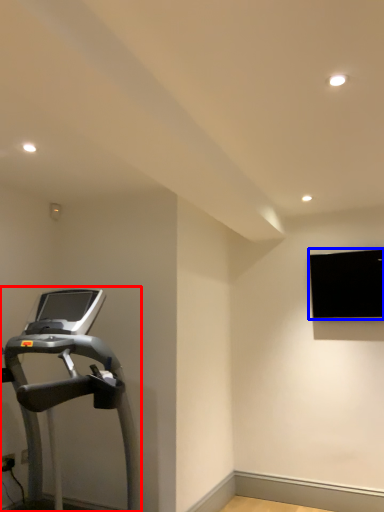
Question: Which object appears farthest to the camera in this image, treadmill (highlighted by a red box) or projection screen (highlighted by a blue box)?

Choices:
 (A) treadmill
 (B) projection screen

Answer: (B)